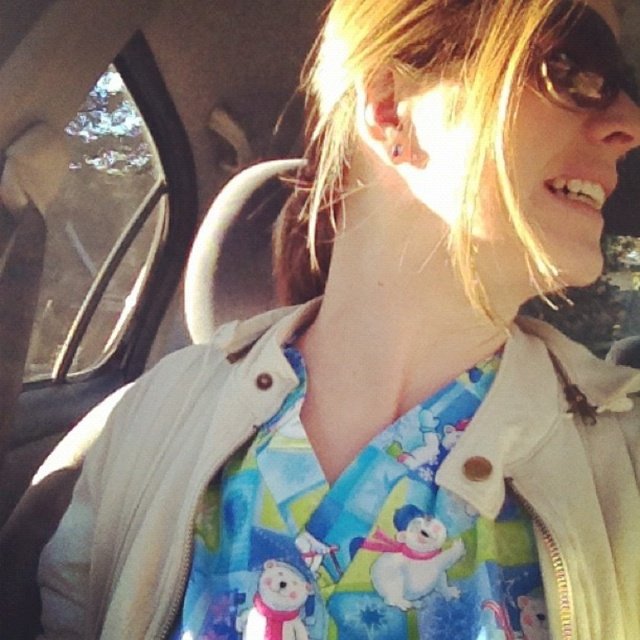
You are a passenger in a car and want to see the outside view clearly. You have the transparent glass car window at left and the transparent plastic goggles at upper right. Which object should you use to look outside without obstruction?

The transparent glass car window at left is bigger than transparent plastic goggles at upper right, so you should use the transparent glass car window at left to look outside without obstruction because it provides a wider and clearer view.

You are a passenger in a car and want to see the scenery outside without the bright glare from the transparent glass car window at left. You have transparent plastic goggles at upper right. Can you wear the goggles to reduce the glare from the window?

The transparent plastic goggles at upper right are positioned to the right of the transparent glass car window at left. Since the goggles are near the upper right, they can be worn to help reduce the glare coming from the window on the left.

From the picture: You are a passenger in a car and want to look outside. The transparent glass car window at left and the transparent plastic goggles at upper right are both in your view. Which object is farther away from you?

The transparent glass car window at left is farther away from you than the transparent plastic goggles at upper right because it is 2.76 meters away from the goggles.